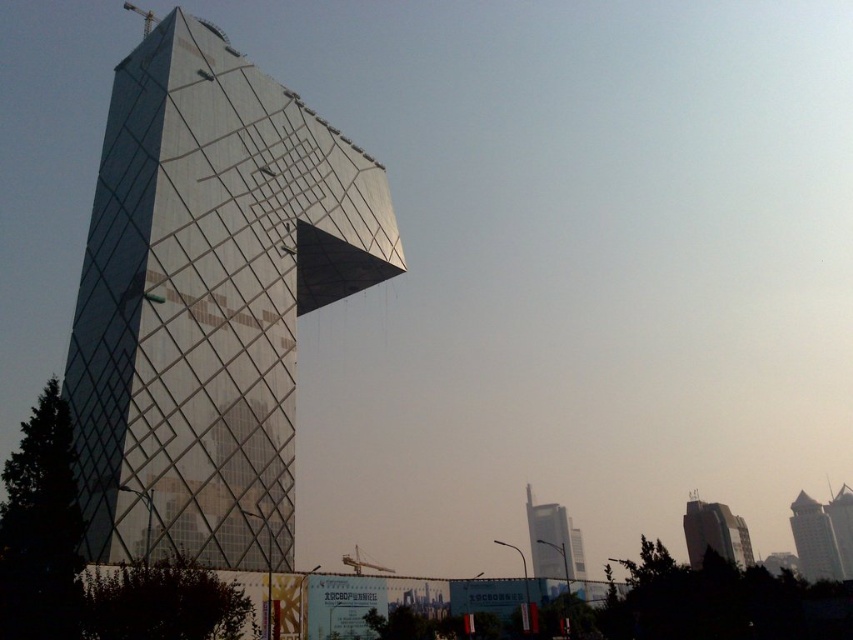
You are standing in front of the modern architectural structure and want to determine the relative positions of two points marked on the building. Which point is closer to you, point (x=537, y=528) or point (x=819, y=563)?

Point (x=537, y=528) is closer to the camera than point (x=819, y=563).

You are an architect reviewing the design plans for a new city development. You notice two structures in the proposed layout, the metallic glass tower at center and the glassy silver skyscraper at center. According to the design, which one is closer to the observer?

The metallic glass tower at center is in front of the glassy silver skyscraper at center, so the metallic glass tower at center is closer to the observer.

You are standing at a viewpoint 60 meters away from the glassy silver skyscraper at center. Can you safely walk towards it without exceeding the 60 meter limit?

The glassy silver skyscraper at center is 64.51 meters away from the viewer. Since you are already at 60 meters, walking towards it would mean you are already past the limit. Therefore, you cannot safely walk towards it without exceeding the 60 meter limit.